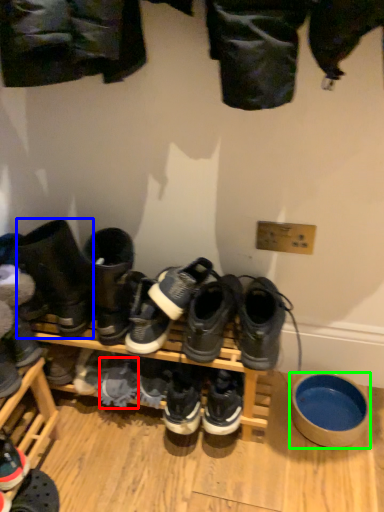
Question: Which object is the closest to the shoe (highlighted by a red box)? Choose among these: footwear (highlighted by a blue box) or bowl (highlighted by a green box).

Choices:
 (A) footwear
 (B) bowl

Answer: (A)